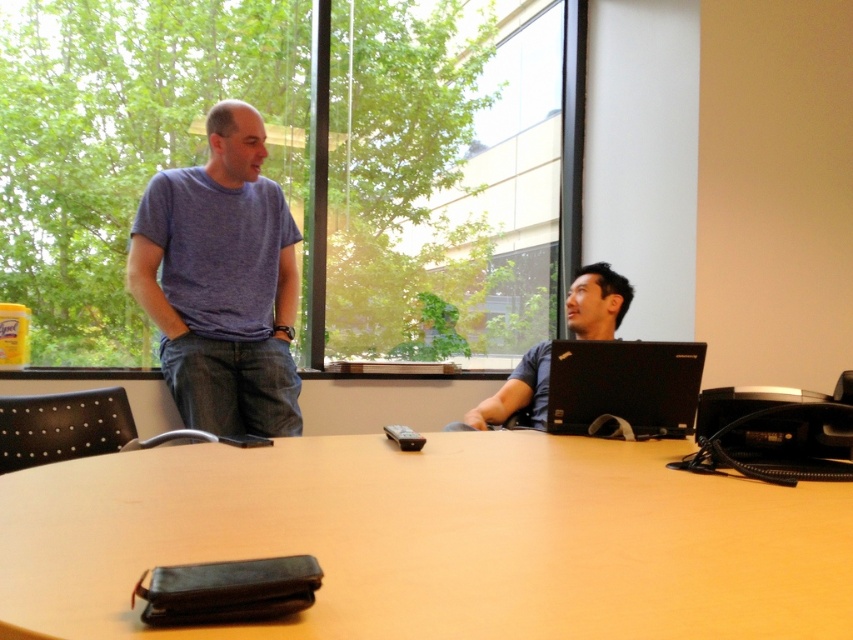
Question: Which point is closer to the camera?

Choices:
 (A) (490, 342)
 (B) (437, 541)

Answer: (B)

Question: Does transparent glass window at upper center appear under matte blue t-shirt at left?

Choices:
 (A) no
 (B) yes

Answer: (A)

Question: In this image, where is transparent glass window at upper center located relative to matte blue t-shirt at left?

Choices:
 (A) right
 (B) left

Answer: (B)

Question: Which point is farther from the camera taking this photo?

Choices:
 (A) (642, 378)
 (B) (248, 172)

Answer: (B)

Question: Considering the relative positions of light brown wooden table at center and matte blue t-shirt at left in the image provided, where is light brown wooden table at center located with respect to matte blue t-shirt at left?

Choices:
 (A) above
 (B) below

Answer: (B)

Question: Which object appears farthest from the camera in this image?

Choices:
 (A) matte black laptop at right
 (B) transparent glass window at upper center
 (C) light brown wooden table at center
 (D) black matte laptop at right

Answer: (B)